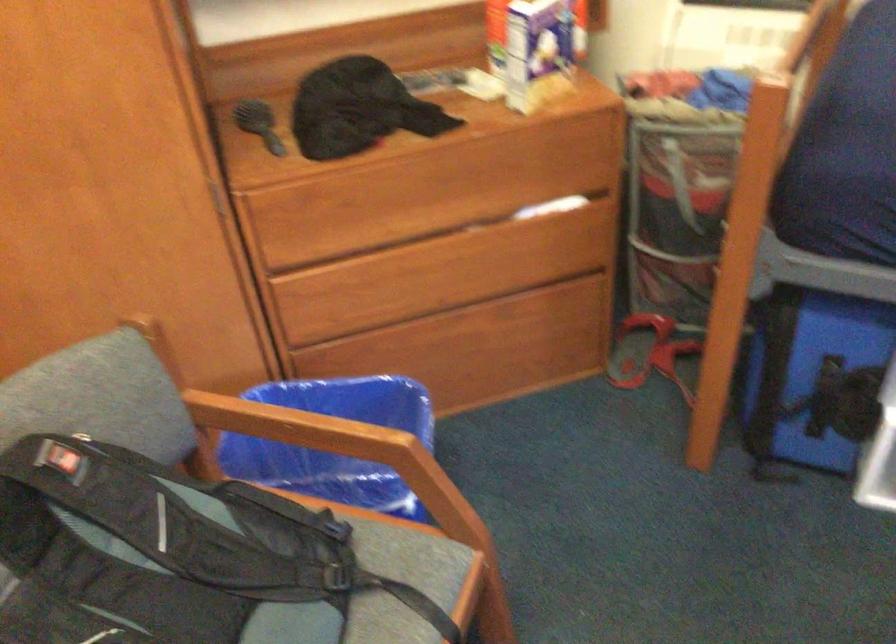
At what (x,y) coordinates should I click in order to perform the action: click on black backpack. Please return your answer as a coordinate pair (x, y). This screenshot has width=896, height=644. Looking at the image, I should click on (162, 543).